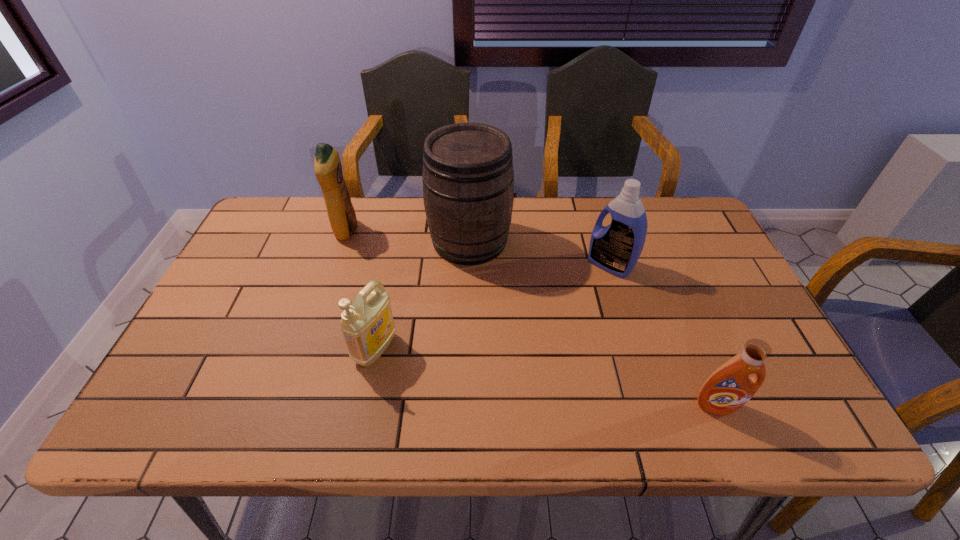
I want to click on wine bucket, so click(468, 179).

The height and width of the screenshot is (540, 960). Identify the location of the leftmost object. (327, 165).

Locate an element on the screen. The height and width of the screenshot is (540, 960). the farthest detergent is located at coordinates (327, 165).

The width and height of the screenshot is (960, 540). I want to click on the second detergent from right to left, so click(616, 248).

Locate an element on the screen. The image size is (960, 540). the second object from right to left is located at coordinates (616, 248).

Find the location of a particular element. Image resolution: width=960 pixels, height=540 pixels. the second nearest object is located at coordinates coord(367,325).

You are a GUI agent. You are given a task and a screenshot of the screen. Output one action in this format:
    pyautogui.click(x=<x>, y=<y>)
    Task: Click on the second detergent from left to right
    
    Given the screenshot: What is the action you would take?
    pyautogui.click(x=367, y=325)

You are a GUI agent. You are given a task and a screenshot of the screen. Output one action in this format:
    pyautogui.click(x=<x>, y=<y>)
    Task: Click on the nearest object
    The width and height of the screenshot is (960, 540).
    Given the screenshot: What is the action you would take?
    pyautogui.click(x=729, y=387)

This screenshot has width=960, height=540. Identify the location of the rightmost object. (729, 387).

This screenshot has height=540, width=960. I want to click on vacant space located on the front of the wine bucket, so click(x=468, y=393).